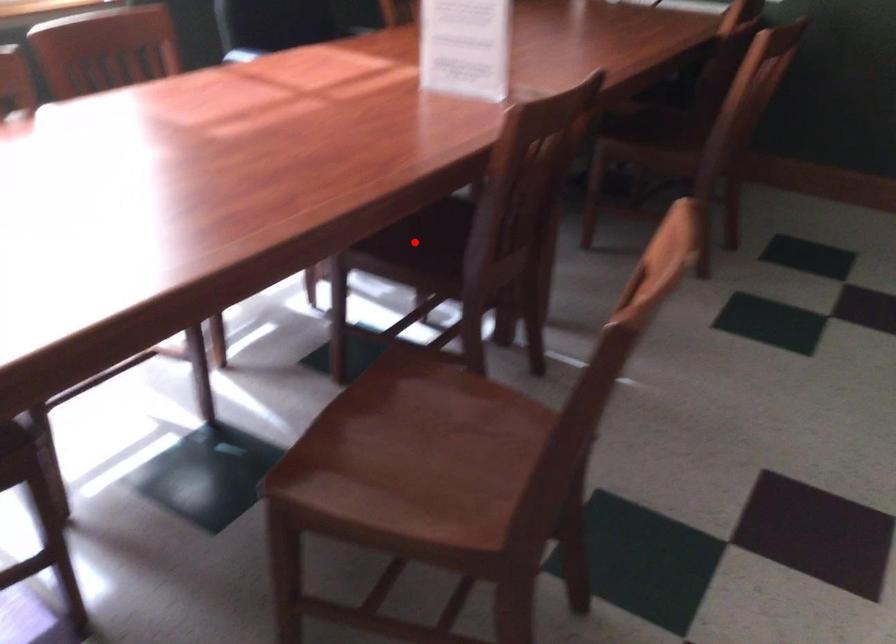
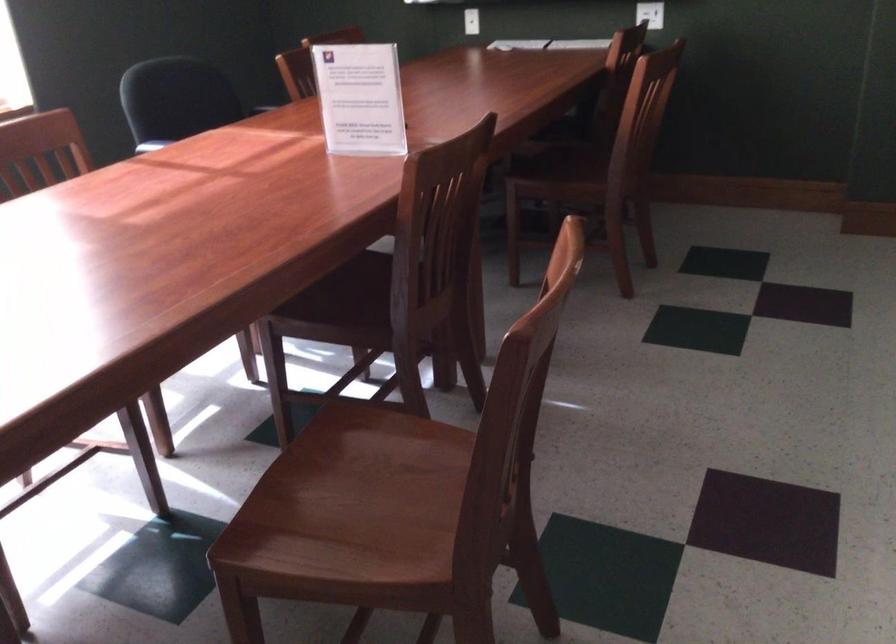
Find the pixel in the second image that matches the highlighted location in the first image.

(340, 301)